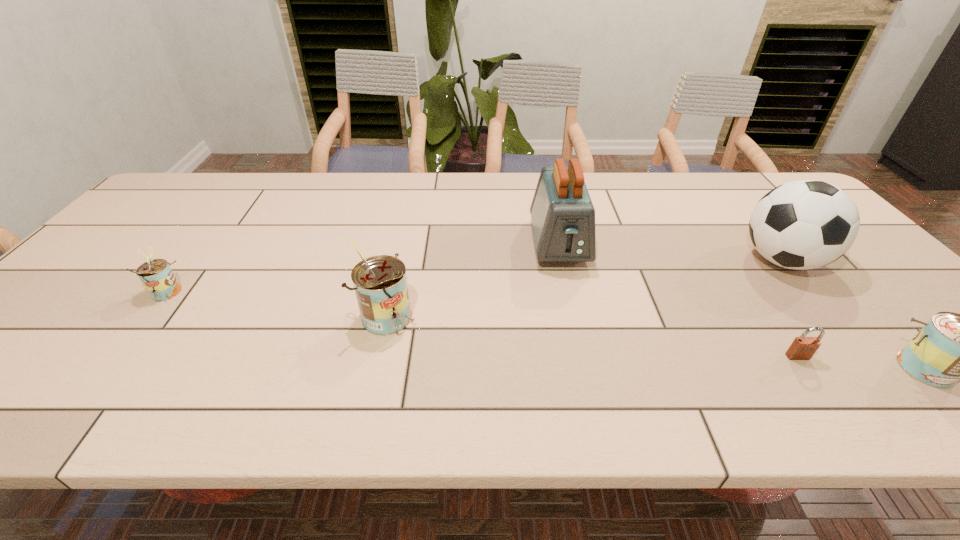
Please determine a free point for an extra can to ensure balance. Please provide its 2D coordinates. Your answer should be formatted as a tuple, i.e. [(x, y)], where the tuple contains the x and y coordinates of a point satisfying the conditions above.

[(641, 342)]